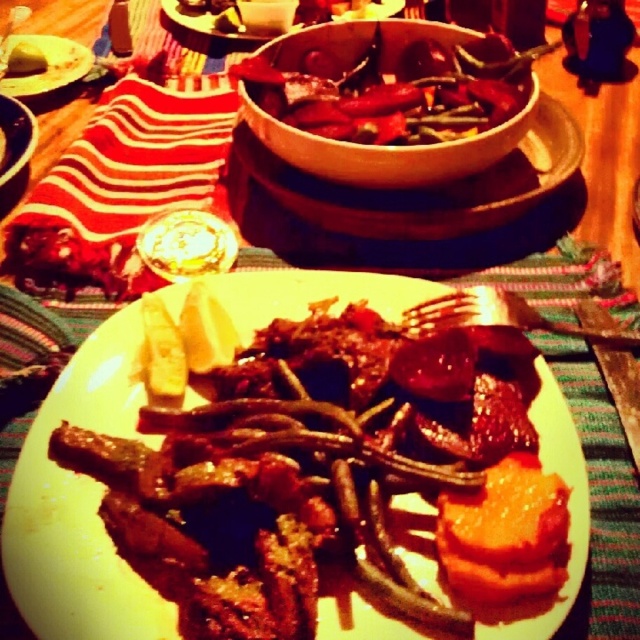
You are an AI analyzing the dining scene. The coordinates given are in a normalized system where the bottom left corner is the origin point. Where is the matte white plate at upper left located in terms of its coordinates?

The matte white plate at upper left is located at coordinates point (42, 65).

You are setting the table for a dinner party and need to place the smooth red chili pepper at center and the matte white plate at upper left. Based on the scene, where should you position the chili pepper relative to the plate?

The smooth red chili pepper at center should be placed below the matte white plate at upper left as per the scene description.